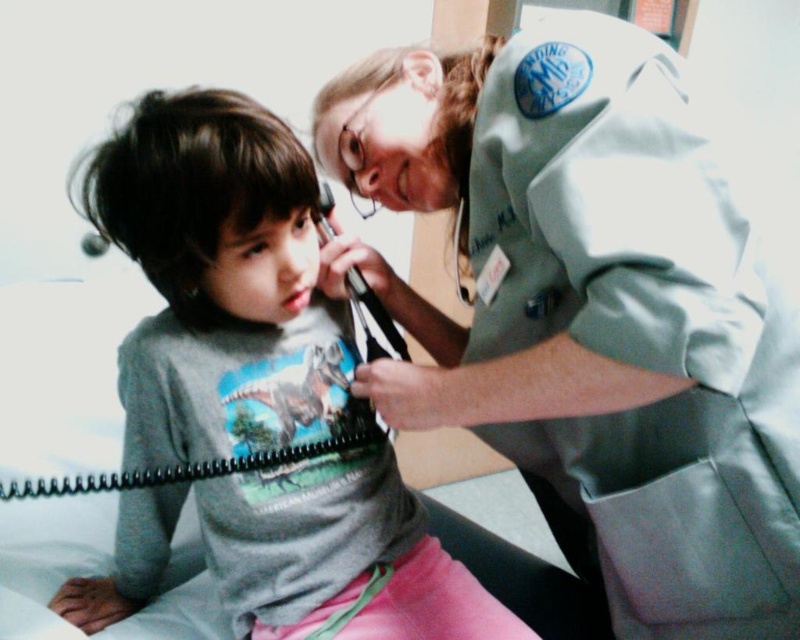
Question: Which point is farther to the camera?

Choices:
 (A) (289, 509)
 (B) (742, 467)

Answer: (A)

Question: Does gray smooth uniform at upper right have a larger size compared to gray matte shirt at center?

Choices:
 (A) no
 (B) yes

Answer: (B)

Question: Which point is farther from the camera taking this photo?

Choices:
 (A) (282, 216)
 (B) (601, 120)

Answer: (A)

Question: Is gray smooth uniform at upper right further to the viewer compared to gray matte shirt at center?

Choices:
 (A) no
 (B) yes

Answer: (A)

Question: Among these objects, which one is nearest to the camera?

Choices:
 (A) gray matte shirt at center
 (B) gray smooth uniform at upper right

Answer: (B)

Question: Is gray smooth uniform at upper right further to the viewer compared to gray matte shirt at center?

Choices:
 (A) no
 (B) yes

Answer: (A)